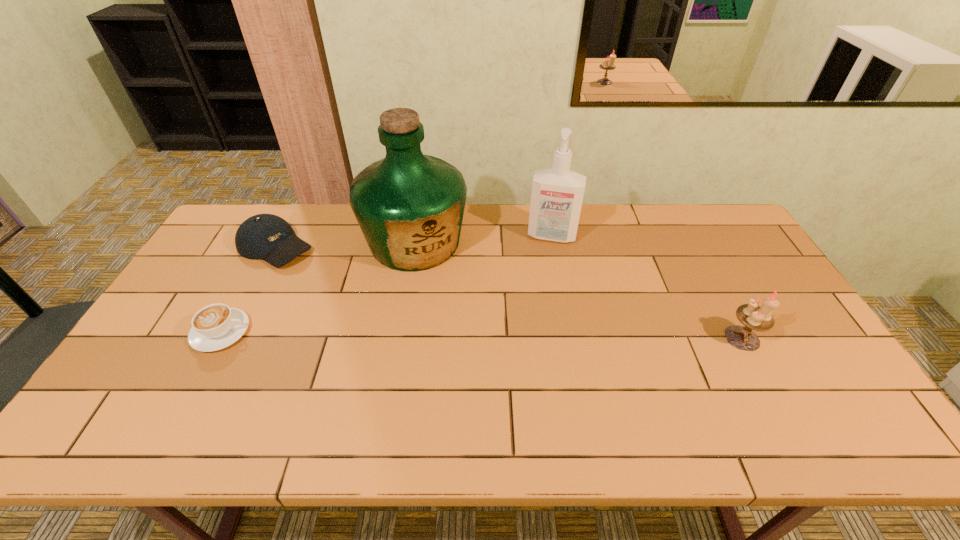
Locate an element on the screen. This screenshot has height=540, width=960. free space at the far right corner of the desktop is located at coordinates (715, 222).

The width and height of the screenshot is (960, 540). I want to click on vacant region between the candle holder and the shortest object, so click(481, 335).

Where is `blank region between the liquor and the baseball cap`? blank region between the liquor and the baseball cap is located at coordinates (346, 245).

I want to click on blank region between the shortest object and the baseball cap, so click(248, 289).

I want to click on vacant area that lies between the cappuccino and the fourth tallest object, so click(248, 289).

Locate an element on the screen. vacant space that is in between the shortest object and the liquor is located at coordinates (318, 287).

Where is `vacant space in between the second shortest object and the cappuccino`? The image size is (960, 540). vacant space in between the second shortest object and the cappuccino is located at coordinates (248, 289).

In order to click on unoccupied area between the cappuccino and the baseball cap in this screenshot , I will do `click(248, 289)`.

Locate an element on the screen. This screenshot has height=540, width=960. vacant area that lies between the baseball cap and the liquor is located at coordinates point(346,245).

Where is `vacant region between the shortest object and the baseball cap`? This screenshot has height=540, width=960. vacant region between the shortest object and the baseball cap is located at coordinates (248, 289).